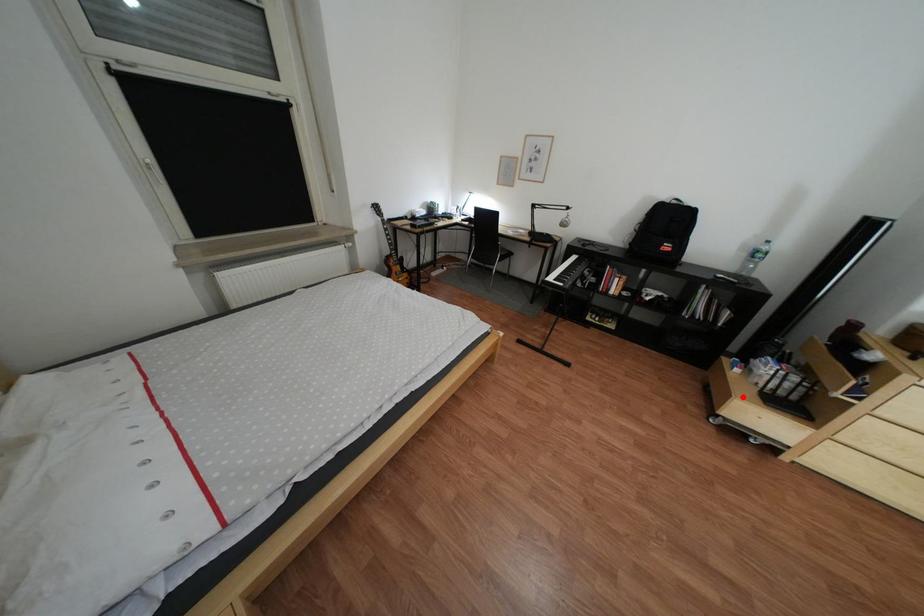
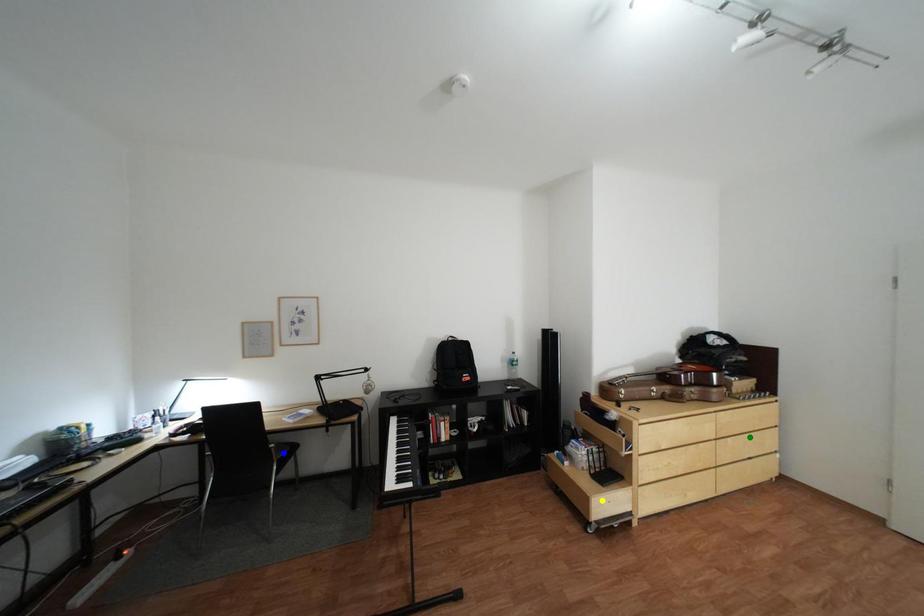
Question: I am providing you with two images of the same scene from different viewpoints. A red point is marked on the first image. You are given multiple points on the second image. Which spot in image 2 lines up with the point in image 1?

Choices:
 (A) blue point
 (B) yellow point
 (C) green point

Answer: (B)